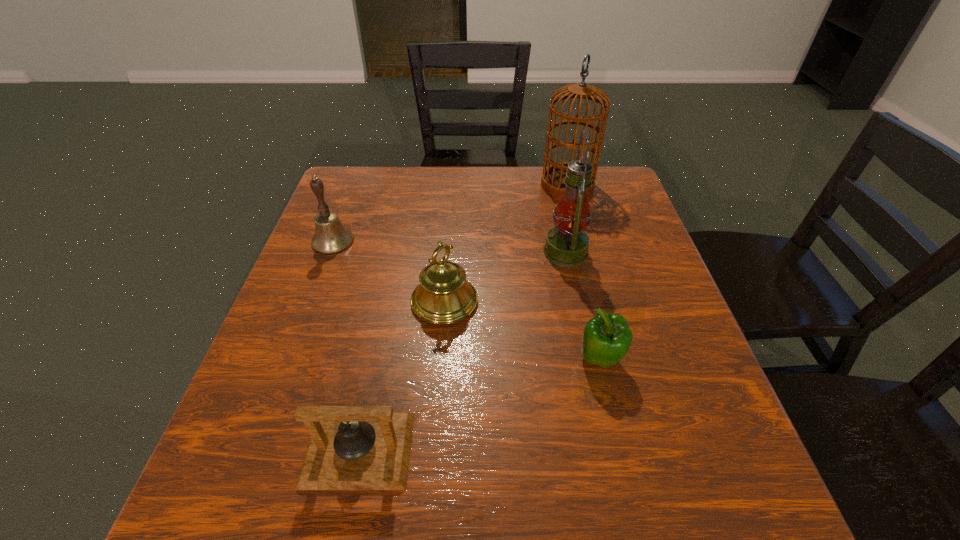
You are a GUI agent. You are given a task and a screenshot of the screen. Output one action in this format:
    pyautogui.click(x=<x>, y=<y>)
    Task: Click on the vacant space situated 0.050m on the right of the farthest object
    Image resolution: width=960 pixels, height=540 pixels.
    Given the screenshot: What is the action you would take?
    pyautogui.click(x=611, y=185)

Image resolution: width=960 pixels, height=540 pixels. What are the coordinates of `free space located on the right of the oil lamp` in the screenshot? It's located at (637, 252).

What are the coordinates of `free space located on the front of the leftmost object` in the screenshot? It's located at (300, 329).

Locate an element on the screen. vacant space located on the back of the second nearest bell is located at coordinates (452, 202).

Identify the location of vacant space located 0.330m on the left of the second nearest object. The width and height of the screenshot is (960, 540). (405, 360).

Where is `vacant space situated 0.160m on the right of the nearest bell`? vacant space situated 0.160m on the right of the nearest bell is located at coordinates (509, 449).

Locate an element on the screen. object that is positioned at the far edge is located at coordinates (552, 181).

At what (x,y) coordinates should I click in order to perform the action: click on object that is at the near edge. Please return your answer as a coordinate pair (x, y). The image size is (960, 540). Looking at the image, I should click on (x=351, y=447).

Image resolution: width=960 pixels, height=540 pixels. Identify the location of birdcage that is at the right edge. (552, 181).

Image resolution: width=960 pixels, height=540 pixels. What are the coordinates of `oil lamp situated at the right edge` in the screenshot? It's located at (567, 243).